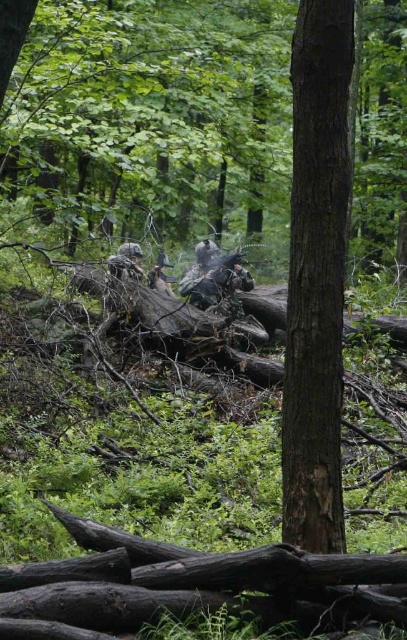
Question: Which point is closer to the camera taking this photo?

Choices:
 (A) (304, 570)
 (B) (326, 163)
 (C) (124, 262)

Answer: (A)

Question: Can you confirm if brown rough tree trunk at center is thinner than camouflage uniform at center?

Choices:
 (A) no
 (B) yes

Answer: (B)

Question: Which of the following is the farthest from the observer?

Choices:
 (A) (341, 614)
 (B) (336, 332)
 (C) (118, 250)

Answer: (C)

Question: Does brown rough tree trunk at center have a lesser width compared to camouflage uniform at center?

Choices:
 (A) no
 (B) yes

Answer: (B)

Question: Which of the following is the closest to the observer?

Choices:
 (A) dark brown wood log at center
 (B) camouflage uniform at center
 (C) brown rough tree trunk at center

Answer: (A)

Question: Can you confirm if dark brown wood log at center is thinner than camouflage uniform at center?

Choices:
 (A) no
 (B) yes

Answer: (A)